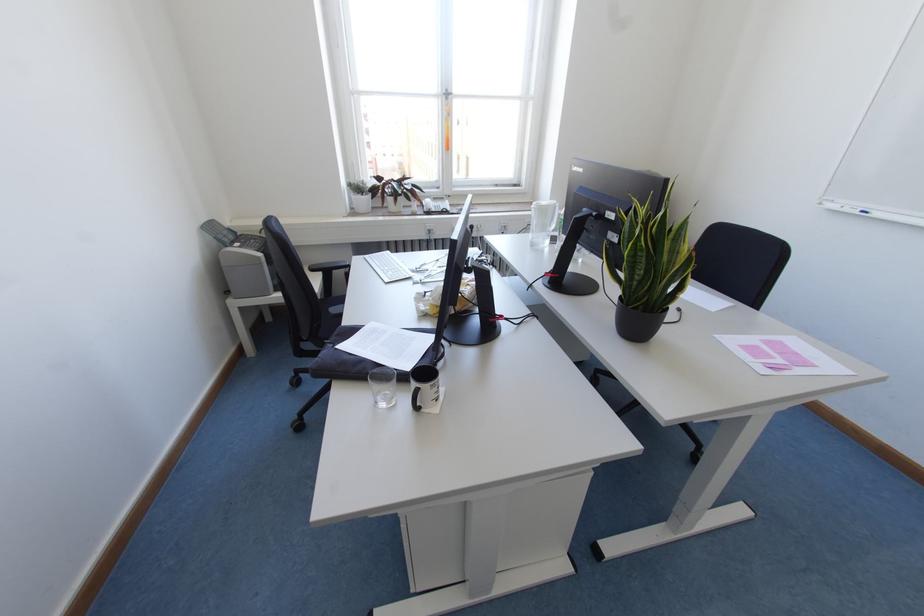
Where would you resting arm the black chair armrest? Please return your answer as a coordinate pair (x, y).

(334, 262)